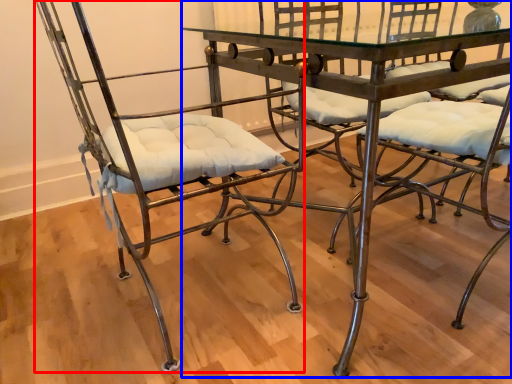
Question: Which point is closer to the camera, chair (highlighted by a red box) or table (highlighted by a blue box)?

Choices:
 (A) chair
 (B) table

Answer: (A)